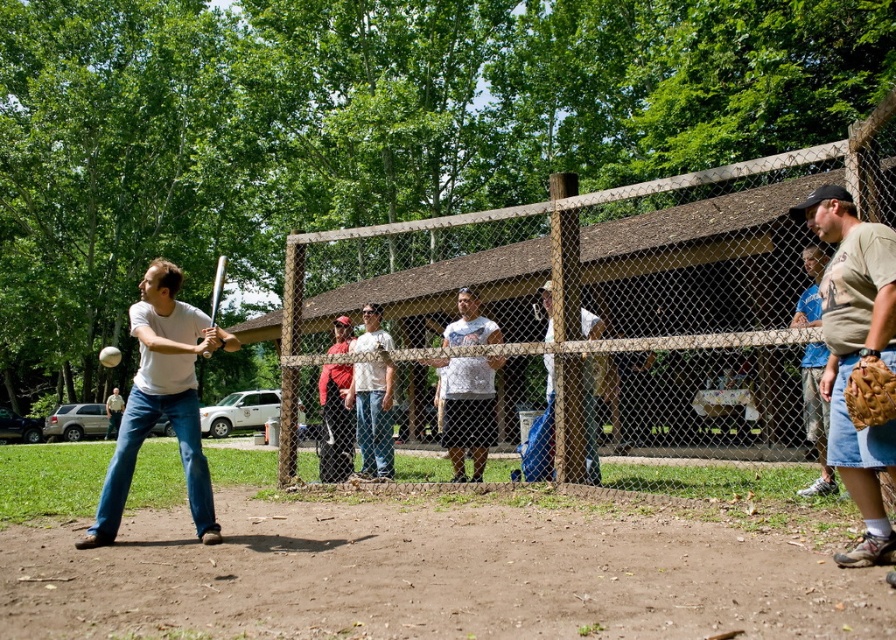
Who is positioned more to the right, white t-shirt at center or white matte shirt at center?

white t-shirt at center is more to the right.

Can you confirm if white t-shirt at center is positioned above white matte shirt at center?

Actually, white t-shirt at center is below white matte shirt at center.

Does point (477, 406) lie in front of point (360, 380)?

Yes.

This screenshot has width=896, height=640. I want to click on white t-shirt at center, so click(468, 410).

Between white matte shirt at center and matte white shirt at center, which one appears on the right side from the viewer's perspective?

white matte shirt at center is more to the right.

Does point (360, 368) lie behind point (121, 397)?

No.

Locate an element on the screen. white matte shirt at center is located at coordinates (373, 417).

Can you confirm if red fabric cap at center is smaller than light brown leather glove at center?

No.

Who is shorter, red fabric cap at center or light brown leather glove at center?

red fabric cap at center

Between point (336, 424) and point (541, 289), which one is positioned in front?

Positioned in front is point (541, 289).

This screenshot has width=896, height=640. I want to click on red fabric cap at center, so click(336, 422).